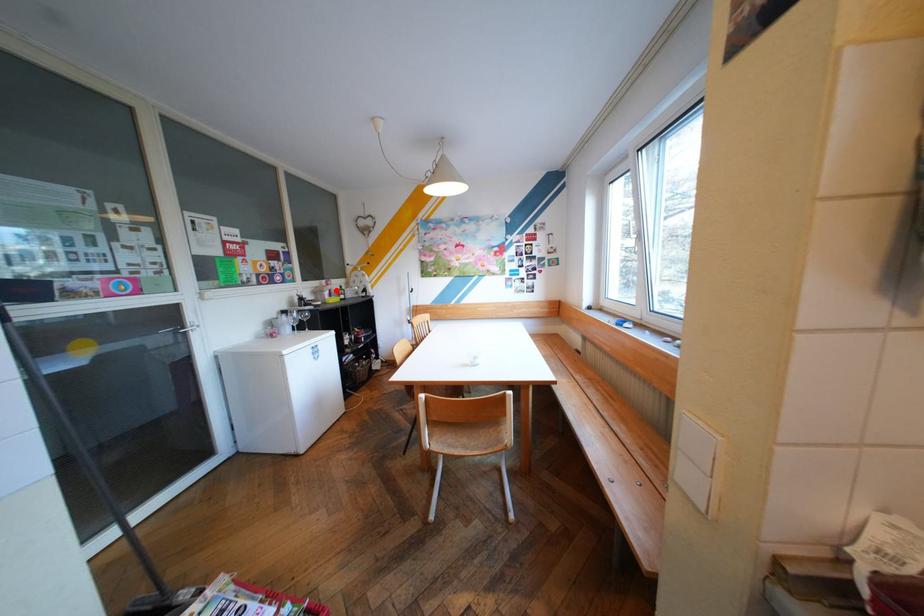
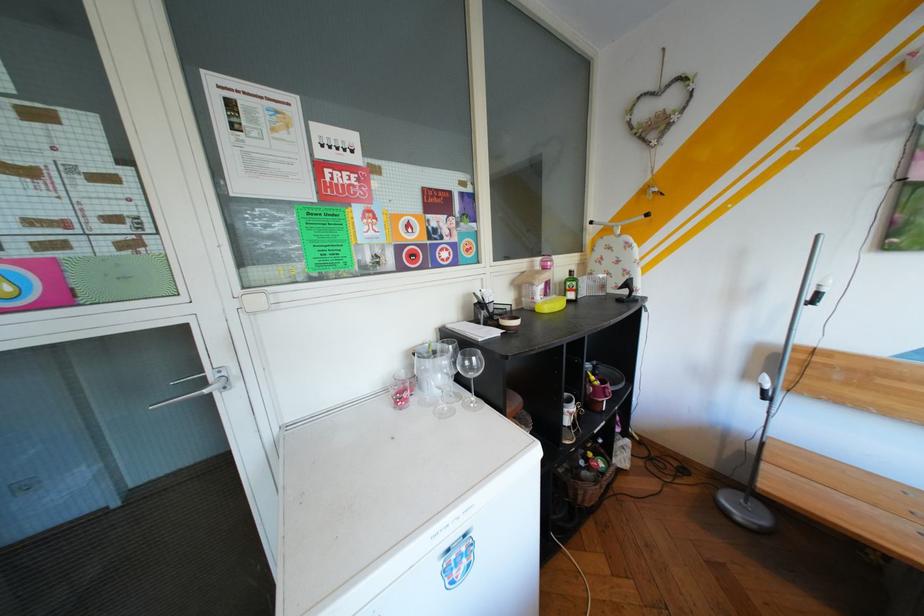
Question: I am providing you with two images of the same scene from different viewpoints. A red point is marked on the first image. Is the red point's position out of view in image 2?

Choices:
 (A) Yes
 (B) No

Answer: (B)